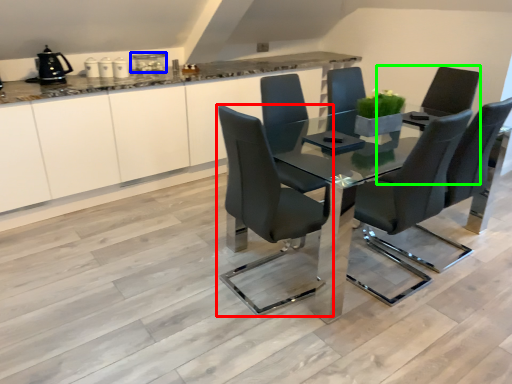
Question: Which object is positioned farthest from chair (highlighted by a red box)? Select from appliance (highlighted by a blue box) and armchair (highlighted by a green box).

Choices:
 (A) appliance
 (B) armchair

Answer: (A)